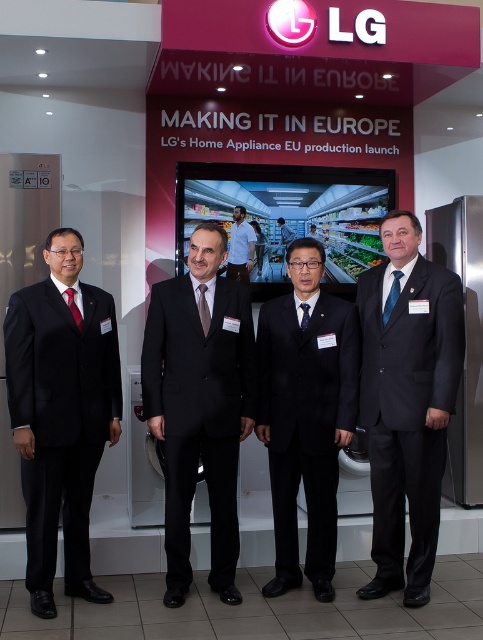
Question: Which point is farther to the camera?

Choices:
 (A) blue textured tie at center
 (B) matte black suit at left
 (C) black suit at center

Answer: (A)

Question: Is blue satin tie at center positioned in front of matte red tie at center?

Choices:
 (A) yes
 (B) no

Answer: (B)

Question: Is matte black suit at right behind white shirt at center?

Choices:
 (A) no
 (B) yes

Answer: (A)

Question: Which of the following is the closest to the observer?

Choices:
 (A) (190, 442)
 (B) (392, 301)

Answer: (A)

Question: Considering the real-world distances, which object is closest to the blue satin tie at center?

Choices:
 (A) blue textured tie at center
 (B) matte red tie at center
 (C) white shirt at center

Answer: (A)

Question: Can you confirm if black matte suit at center is positioned to the left of matte red tie at center?

Choices:
 (A) no
 (B) yes

Answer: (A)